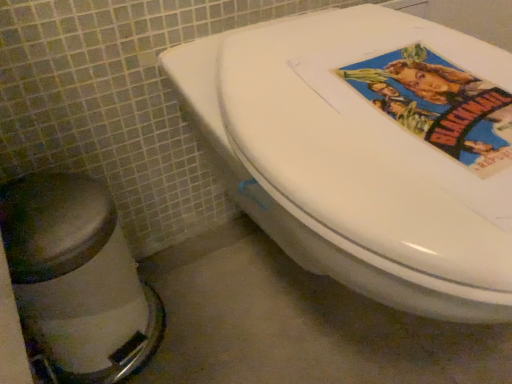
Question: Considering the relative sizes of brushed metal bidet at lower left and white glossy toilet at center in the image provided, is brushed metal bidet at lower left shorter than white glossy toilet at center?

Choices:
 (A) no
 (B) yes

Answer: (B)

Question: Is brushed metal bidet at lower left far from white glossy toilet at center?

Choices:
 (A) yes
 (B) no

Answer: (B)

Question: Does brushed metal bidet at lower left lie behind white glossy toilet at center?

Choices:
 (A) yes
 (B) no

Answer: (A)

Question: From the image's perspective, does brushed metal bidet at lower left appear higher than white glossy toilet at center?

Choices:
 (A) yes
 (B) no

Answer: (B)

Question: Is the depth of brushed metal bidet at lower left less than that of white glossy toilet at center?

Choices:
 (A) yes
 (B) no

Answer: (B)

Question: Does brushed metal bidet at lower left have a greater height compared to white glossy toilet at center?

Choices:
 (A) no
 (B) yes

Answer: (A)

Question: Considering the relative positions of white glossy toilet at center and brushed metal bidet at lower left in the image provided, is white glossy toilet at center to the left of brushed metal bidet at lower left from the viewer's perspective?

Choices:
 (A) yes
 (B) no

Answer: (B)

Question: From a real-world perspective, does white glossy toilet at center stand above brushed metal bidet at lower left?

Choices:
 (A) yes
 (B) no

Answer: (A)

Question: From the image's perspective, is white glossy toilet at center beneath brushed metal bidet at lower left?

Choices:
 (A) no
 (B) yes

Answer: (A)

Question: Is white glossy toilet at center to the right of brushed metal bidet at lower left from the viewer's perspective?

Choices:
 (A) no
 (B) yes

Answer: (B)

Question: Is white glossy toilet at center positioned in front of brushed metal bidet at lower left?

Choices:
 (A) no
 (B) yes

Answer: (B)

Question: Does white glossy toilet at center have a greater width compared to brushed metal bidet at lower left?

Choices:
 (A) yes
 (B) no

Answer: (A)

Question: In terms of height, does white glossy toilet at center look taller or shorter compared to brushed metal bidet at lower left?

Choices:
 (A) short
 (B) tall

Answer: (B)